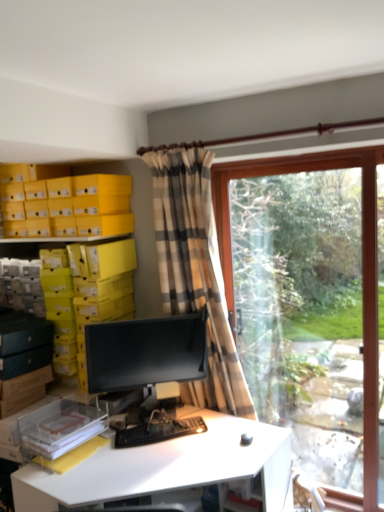
Question: Considering the relative sizes of plaid fabric curtain at center and clear glass window at right in the image provided, is plaid fabric curtain at center bigger than clear glass window at right?

Choices:
 (A) no
 (B) yes

Answer: (A)

Question: Is plaid fabric curtain at center completely or partially outside of clear glass window at right?

Choices:
 (A) no
 (B) yes

Answer: (B)

Question: Considering the relative positions of plaid fabric curtain at center and clear glass window at right in the image provided, is plaid fabric curtain at center behind clear glass window at right?

Choices:
 (A) yes
 (B) no

Answer: (B)

Question: Is plaid fabric curtain at center at the right side of clear glass window at right?

Choices:
 (A) yes
 (B) no

Answer: (B)

Question: Is plaid fabric curtain at center closer to the viewer compared to clear glass window at right?

Choices:
 (A) yes
 (B) no

Answer: (A)

Question: From a real-world perspective, is plaid fabric curtain at center located beneath clear glass window at right?

Choices:
 (A) yes
 (B) no

Answer: (B)

Question: From the image's perspective, is plaid fabric curtain at center located beneath white glossy desk at center?

Choices:
 (A) no
 (B) yes

Answer: (A)

Question: Does plaid fabric curtain at center turn towards white glossy desk at center?

Choices:
 (A) yes
 (B) no

Answer: (A)

Question: From a real-world perspective, is plaid fabric curtain at center over white glossy desk at center?

Choices:
 (A) yes
 (B) no

Answer: (A)

Question: Is the depth of plaid fabric curtain at center less than that of white glossy desk at center?

Choices:
 (A) yes
 (B) no

Answer: (B)

Question: From a real-world perspective, is plaid fabric curtain at center beneath white glossy desk at center?

Choices:
 (A) no
 (B) yes

Answer: (A)

Question: Is plaid fabric curtain at center to the left of white glossy desk at center from the viewer's perspective?

Choices:
 (A) no
 (B) yes

Answer: (A)

Question: Considering the relative sizes of yellow cardboard boxes at upper left and black matte keyboard at center in the image provided, is yellow cardboard boxes at upper left smaller than black matte keyboard at center?

Choices:
 (A) no
 (B) yes

Answer: (A)